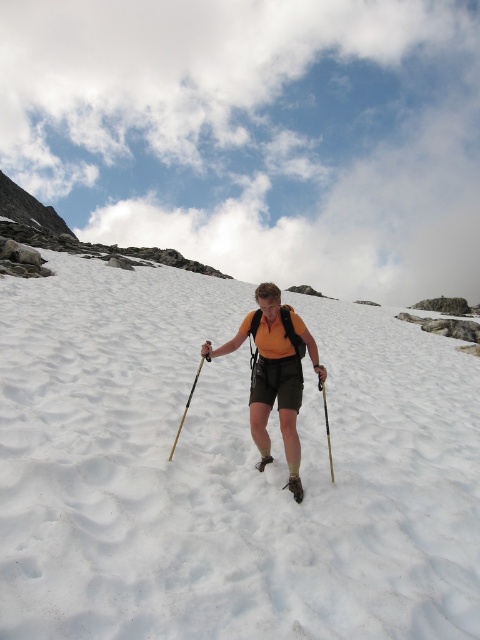
Question: Which of the following is the farthest from the observer?

Choices:
 (A) (202, 356)
 (B) (460, 481)

Answer: (B)

Question: Can you confirm if orange fabric shorts at center is smaller than black plastic ski pole at center?

Choices:
 (A) yes
 (B) no

Answer: (B)

Question: Which of these objects is positioned farthest from the white powdery snow at center?

Choices:
 (A) wooden ski pole at center
 (B) orange fabric shorts at center

Answer: (A)

Question: Does white powdery snow at center appear under black plastic ski pole at center?

Choices:
 (A) yes
 (B) no

Answer: (B)

Question: Which of the following is the closest to the observer?

Choices:
 (A) (323, 397)
 (B) (194, 378)
 (C) (300, 364)

Answer: (C)

Question: Does orange fabric shorts at center have a smaller size compared to black plastic ski pole at center?

Choices:
 (A) no
 (B) yes

Answer: (A)